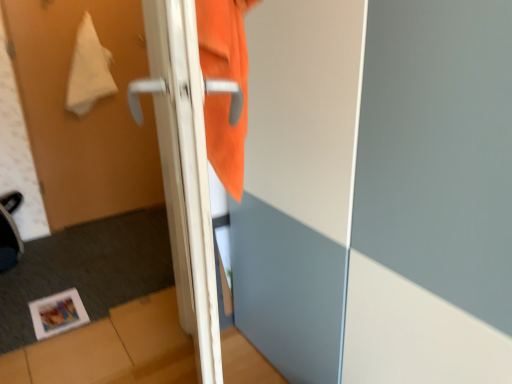
Describe the element at coordinates (432, 197) in the screenshot. I see `orange fabric at center, arranged as the 1th screen door when viewed from the right` at that location.

In order to face orange fabric sweatshirt at upper center, should I rotate leftwards or rightwards?

Rotate your view left by about 1.959°.

The width and height of the screenshot is (512, 384). I want to click on matte paper photo frame at lower left, so click(57, 313).

Image resolution: width=512 pixels, height=384 pixels. Describe the element at coordinates (183, 170) in the screenshot. I see `white glossy door handle at center` at that location.

Where is `white glossy door handle at left, the second screen door when ordered from left to right`? white glossy door handle at left, the second screen door when ordered from left to right is located at coordinates (185, 171).

At what (x,y) coordinates should I click in order to perform the action: click on orange fabric at center, the third screen door viewed from the left. Please return your answer as a coordinate pair (x, y). Looking at the image, I should click on (432, 197).

Is matte paper photo frame at lower left not within white glossy door handle at center?

Yes, matte paper photo frame at lower left is outside of white glossy door handle at center.

How different are the orientations of matte paper photo frame at lower left and white glossy door handle at center in degrees?

The angle between the facing direction of matte paper photo frame at lower left and the facing direction of white glossy door handle at center is 109 degrees.

Locate an element on the screen. door that appears on the right of matte paper photo frame at lower left is located at coordinates (183, 170).

In the scene shown: From a real-world perspective, who is located higher, matte paper photo frame at lower left or white glossy door handle at center?

white glossy door handle at center, from a real-world perspective.

Which object is wider, white glossy door handle at center or white glossy door handle at left, the second screen door from the right?

white glossy door handle at center.

Is point (166, 144) more distant than point (203, 176)?

Yes.

Is white glossy door handle at center closer to the viewer compared to white glossy door handle at left, the second screen door from the right?

Yes, white glossy door handle at center is closer to the camera.

Who is bigger, white matte towel at upper left, placed as the 3th screen door when sorted from right to left, or white glossy door handle at center?

white glossy door handle at center.

Who is taller, white matte towel at upper left, placed as the 3th screen door when sorted from right to left, or white glossy door handle at center?

white matte towel at upper left, placed as the 3th screen door when sorted from right to left, is taller.

Which of these two, white matte towel at upper left, which is the 1th screen door from left to right, or white glossy door handle at center, is wider?

Wider between the two is white glossy door handle at center.

Which is more to the right, orange fabric sweatshirt at upper center or matte paper photo frame at lower left?

orange fabric sweatshirt at upper center.

Does orange fabric sweatshirt at upper center have a lesser width compared to matte paper photo frame at lower left?

Indeed, orange fabric sweatshirt at upper center has a lesser width compared to matte paper photo frame at lower left.

In terms of height, does orange fabric sweatshirt at upper center look taller or shorter compared to matte paper photo frame at lower left?

Considering their sizes, orange fabric sweatshirt at upper center has more height than matte paper photo frame at lower left.

From the image's perspective, who appears lower, white matte towel at upper left, placed as the 3th screen door when sorted from right to left, or orange fabric at center, arranged as the 1th screen door when viewed from the right?

orange fabric at center, arranged as the 1th screen door when viewed from the right, is shown below in the image.

In the scene shown: Is white matte towel at upper left, placed as the 3th screen door when sorted from right to left, situated inside orange fabric at center, the third screen door viewed from the left, or outside?

white matte towel at upper left, placed as the 3th screen door when sorted from right to left, cannot be found inside orange fabric at center, the third screen door viewed from the left.

Are white matte towel at upper left, placed as the 3th screen door when sorted from right to left, and orange fabric at center, the third screen door viewed from the left, located far from each other?

Yes, white matte towel at upper left, placed as the 3th screen door when sorted from right to left, is far from orange fabric at center, the third screen door viewed from the left.

Can you confirm if white matte towel at upper left, placed as the 3th screen door when sorted from right to left, is thinner than orange fabric at center, arranged as the 1th screen door when viewed from the right?

Yes, white matte towel at upper left, placed as the 3th screen door when sorted from right to left, is thinner than orange fabric at center, arranged as the 1th screen door when viewed from the right.

Is orange fabric sweatshirt at upper center oriented away from white fabric towel at upper left?

No, orange fabric sweatshirt at upper center is not facing away from white fabric towel at upper left.

Is orange fabric sweatshirt at upper center situated inside white fabric towel at upper left or outside?

orange fabric sweatshirt at upper center lies outside white fabric towel at upper left.

Which is more to the left, orange fabric sweatshirt at upper center or white fabric towel at upper left?

white fabric towel at upper left.

From the image's perspective, which is below, orange fabric sweatshirt at upper center or white fabric towel at upper left?

orange fabric sweatshirt at upper center, from the image's perspective.

Does point (204, 57) lie in front of point (470, 288)?

Yes, it is in front of point (470, 288).

Is orange fabric sweatshirt at upper center turned away from orange fabric at center, the third screen door viewed from the left?

No, orange fabric at center, the third screen door viewed from the left, is not at the back of orange fabric sweatshirt at upper center.

From the image's perspective, is orange fabric sweatshirt at upper center above or below orange fabric at center, arranged as the 1th screen door when viewed from the right?

Based on their image positions, orange fabric sweatshirt at upper center is located above orange fabric at center, arranged as the 1th screen door when viewed from the right.

Would you say orange fabric sweatshirt at upper center is a long distance from orange fabric at center, arranged as the 1th screen door when viewed from the right?

That's not correct — orange fabric sweatshirt at upper center is a little close to orange fabric at center, arranged as the 1th screen door when viewed from the right.

Identify the location of magazine on the left of white glossy door handle at center. This screenshot has height=384, width=512. (57, 313).

Where is `door on the right side of white glossy door handle at left, the second screen door when ordered from left to right`? The height and width of the screenshot is (384, 512). door on the right side of white glossy door handle at left, the second screen door when ordered from left to right is located at coordinates (183, 170).

When comparing their distances from matte paper photo frame at lower left, does white matte towel at upper left, which is the 1th screen door from left to right, or white glossy door handle at left, the second screen door from the right, seem further?

white matte towel at upper left, which is the 1th screen door from left to right, lies further to matte paper photo frame at lower left than the other object.

From the picture: Based on their spatial positions, is white matte towel at upper left, which is the 1th screen door from left to right, or orange fabric at center, the third screen door viewed from the left, further from orange fabric sweatshirt at upper center?

Among the two, white matte towel at upper left, which is the 1th screen door from left to right, is located further to orange fabric sweatshirt at upper center.

Looking at the image, which one is located closer to matte paper photo frame at lower left, white glossy door handle at left, the second screen door when ordered from left to right, or white matte towel at upper left, which is the 1th screen door from left to right?

white glossy door handle at left, the second screen door when ordered from left to right, is positioned closer to the anchor matte paper photo frame at lower left.

Looking at the image, which one is located further to white glossy door handle at left, the second screen door when ordered from left to right, white glossy door handle at center or orange fabric at center, arranged as the 1th screen door when viewed from the right?

orange fabric at center, arranged as the 1th screen door when viewed from the right, lies further to white glossy door handle at left, the second screen door when ordered from left to right, than the other object.

When comparing their distances from white glossy door handle at center, does matte paper photo frame at lower left or white fabric towel at upper left seem further?

Based on the image, white fabric towel at upper left appears to be further to white glossy door handle at center.

From the image, which object appears to be farther from orange fabric at center, arranged as the 1th screen door when viewed from the right, white fabric towel at upper left or white glossy door handle at left, the second screen door when ordered from left to right?

The object further to orange fabric at center, arranged as the 1th screen door when viewed from the right, is white fabric towel at upper left.

Consider the image. Looking at the image, which one is located further to orange fabric sweatshirt at upper center, white fabric towel at upper left or matte paper photo frame at lower left?

white fabric towel at upper left lies further to orange fabric sweatshirt at upper center than the other object.

Based on their spatial positions, is white matte towel at upper left, placed as the 3th screen door when sorted from right to left, or white glossy door handle at left, the second screen door from the right, further from orange fabric sweatshirt at upper center?

Among the two, white matte towel at upper left, placed as the 3th screen door when sorted from right to left, is located further to orange fabric sweatshirt at upper center.

Locate an element on the screen. This screenshot has width=512, height=384. magazine positioned between white glossy door handle at left, the second screen door when ordered from left to right, and white fabric towel at upper left from near to far is located at coordinates (57, 313).

You are a GUI agent. You are given a task and a screenshot of the screen. Output one action in this format:
    pyautogui.click(x=<x>, y=<y>)
    Task: Click on the sweatshirt between orange fabric at center, the third screen door viewed from the left, and white matte towel at upper left, which is the 1th screen door from left to right, from front to back
    The width and height of the screenshot is (512, 384).
    Given the screenshot: What is the action you would take?
    pyautogui.click(x=227, y=79)

Find the location of a particular element. This screenshot has width=512, height=384. sweatshirt positioned between white glossy door handle at center and white fabric towel at upper left from near to far is located at coordinates (227, 79).

Locate an element on the screen. magazine positioned between white glossy door handle at center and white matte towel at upper left, which is the 1th screen door from left to right, from near to far is located at coordinates (57, 313).